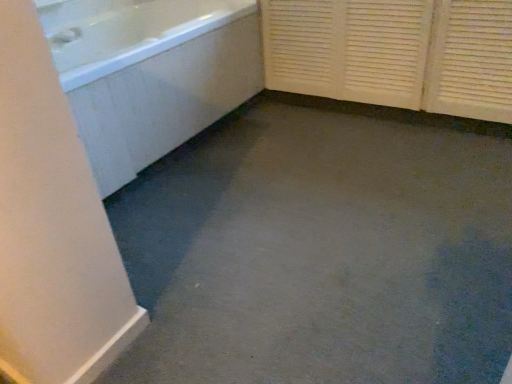
Question: Considering the positions of white glossy faucet at upper left and white textured screen door at right in the image, is white glossy faucet at upper left taller or shorter than white textured screen door at right?

Choices:
 (A) tall
 (B) short

Answer: (B)

Question: From the image's perspective, relative to white textured screen door at right, is white glossy faucet at upper left above or below?

Choices:
 (A) above
 (B) below

Answer: (A)

Question: Which of these objects is positioned farthest from the white textured screen door at right?

Choices:
 (A) white glossy faucet at upper left
 (B) white glossy bathtub at upper left

Answer: (A)

Question: Considering the real-world distances, which object is farthest from the white textured screen door at right?

Choices:
 (A) white glossy bathtub at upper left
 (B) white glossy faucet at upper left

Answer: (B)